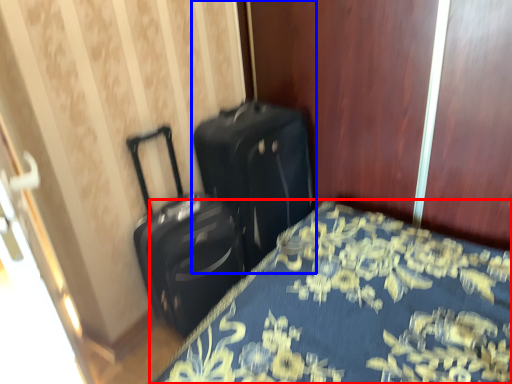
Question: Which of the following is the closest to the observer, bed (highlighted by a red box) or suitcase (highlighted by a blue box)?

Choices:
 (A) bed
 (B) suitcase

Answer: (A)